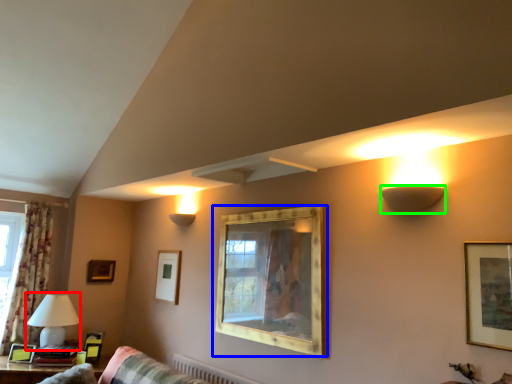
Question: Which object is positioned closest to table lamp (highlighted by a red box)? Select from picture frame (highlighted by a blue box) and lamp (highlighted by a green box).

Choices:
 (A) picture frame
 (B) lamp

Answer: (A)